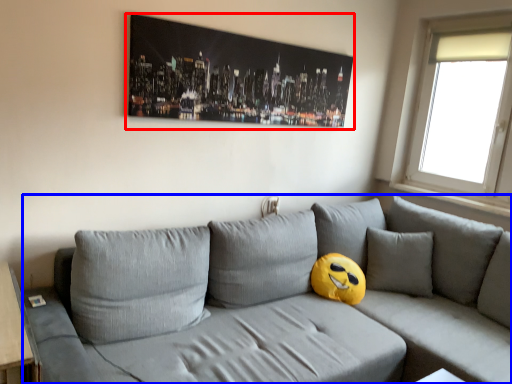
Question: Which point is further to the camera, picture frame (highlighted by a red box) or studio couch (highlighted by a blue box)?

Choices:
 (A) picture frame
 (B) studio couch

Answer: (A)